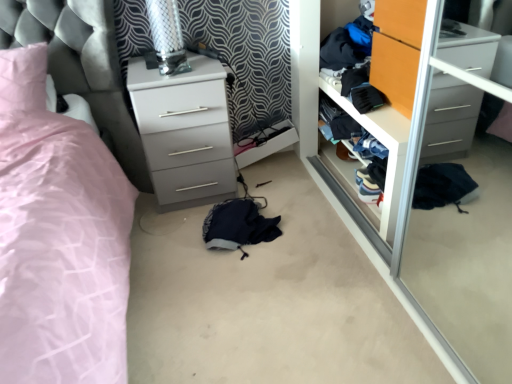
Locate an element on the screen. This screenshot has width=512, height=384. free region on the left part of navy blue fabric at center is located at coordinates [x=166, y=242].